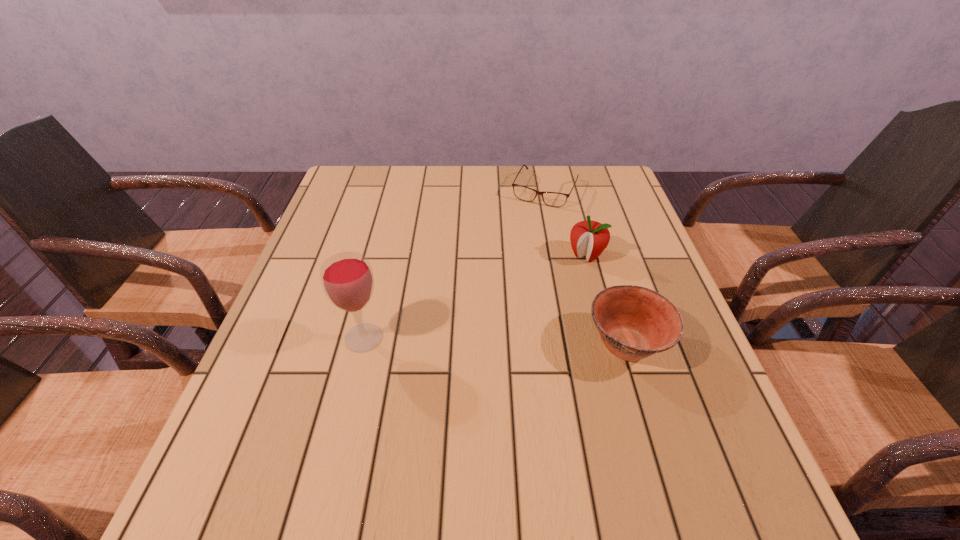
Where is `object positioned at the far right corner`? Image resolution: width=960 pixels, height=540 pixels. object positioned at the far right corner is located at coordinates (554, 199).

Find the location of a particular element. This screenshot has width=960, height=540. free region at the far edge of the desktop is located at coordinates (421, 183).

You are a GUI agent. You are given a task and a screenshot of the screen. Output one action in this format:
    pyautogui.click(x=<x>, y=<y>)
    Task: Click on the free space at the near edge
    Image resolution: width=960 pixels, height=540 pixels.
    Given the screenshot: What is the action you would take?
    pyautogui.click(x=458, y=418)

In the image, there is a desktop. Where is `blank space at the left edge`? blank space at the left edge is located at coordinates (298, 283).

At what (x,y) coordinates should I click in order to perform the action: click on vacant space at the right edge of the desktop. Please return your answer as a coordinate pair (x, y). This screenshot has height=540, width=960. Looking at the image, I should click on click(609, 209).

Image resolution: width=960 pixels, height=540 pixels. What are the coordinates of `vacant space at the far right corner of the desktop` in the screenshot? It's located at (623, 188).

In the image, there is a desktop. Identify the location of free space at the near right corner. The height and width of the screenshot is (540, 960). (688, 426).

This screenshot has width=960, height=540. Find the location of `free space between the wineglass and the bowl`. free space between the wineglass and the bowl is located at coordinates (495, 341).

Image resolution: width=960 pixels, height=540 pixels. Identify the location of vacant region between the third nearest object and the shortest object. (565, 222).

I want to click on vacant area between the bowl and the wineglass, so click(495, 341).